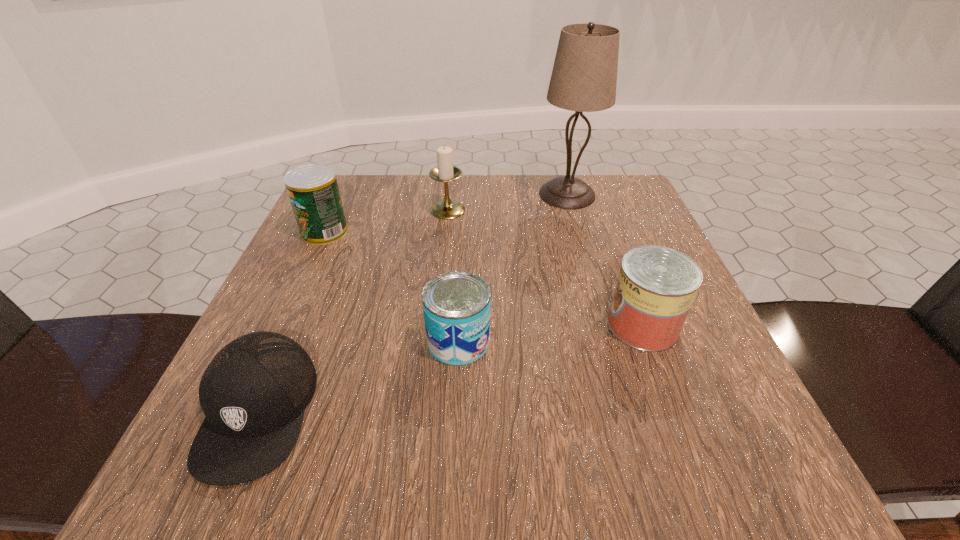
Image resolution: width=960 pixels, height=540 pixels. In order to click on free region located on the front of the shortest can in this screenshot , I will do `click(451, 488)`.

What are the coordinates of `lampshade that is at the far edge` in the screenshot? It's located at (584, 77).

The image size is (960, 540). I want to click on candle holder that is at the far edge, so click(x=445, y=172).

Where is `can that is at the far edge`? This screenshot has height=540, width=960. can that is at the far edge is located at coordinates (313, 190).

Locate an element on the screen. The height and width of the screenshot is (540, 960). object present at the near edge is located at coordinates (253, 393).

The width and height of the screenshot is (960, 540). What are the coordinates of `can situated at the left edge` in the screenshot? It's located at (313, 190).

You are a GUI agent. You are given a task and a screenshot of the screen. Output one action in this format:
    pyautogui.click(x=<x>, y=<y>)
    Task: Click on the cap present at the left edge
    The image size is (960, 540).
    Given the screenshot: What is the action you would take?
    (x=253, y=393)

The height and width of the screenshot is (540, 960). Find the location of `lampshade at the right edge`. lampshade at the right edge is located at coordinates (584, 77).

Where is `can that is at the right edge`? Image resolution: width=960 pixels, height=540 pixels. can that is at the right edge is located at coordinates (656, 286).

Where is `object that is at the far left corner`? The height and width of the screenshot is (540, 960). object that is at the far left corner is located at coordinates (313, 190).